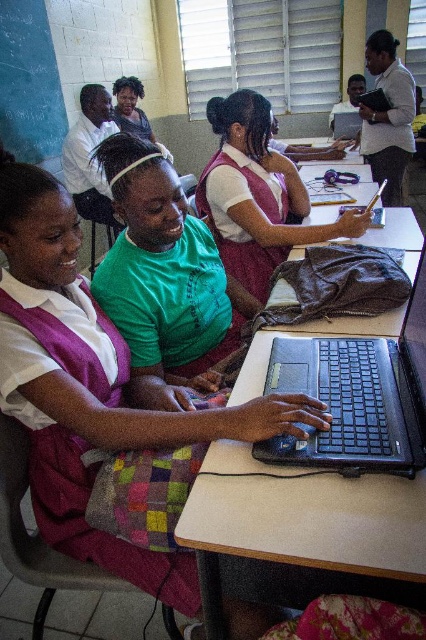
Question: Which object is positioned farthest from the white matte shirt at upper right?

Choices:
 (A) green fabric shirt at center
 (B) black matte laptop at center
 (C) matte pink uniform at center
 (D) matte purple vest at center

Answer: (D)

Question: Which point is farther to the camera?

Choices:
 (A) matte purple vest at center
 (B) white matte shirt at upper right

Answer: (B)

Question: Does matte pink uniform at center appear over white matte shirt at upper right?

Choices:
 (A) yes
 (B) no

Answer: (B)

Question: Does matte purple vest at center appear over white matte shirt at upper right?

Choices:
 (A) no
 (B) yes

Answer: (A)

Question: Observing the image, what is the correct spatial positioning of matte purple vest at center in reference to green fabric shirt at center?

Choices:
 (A) right
 (B) left

Answer: (B)

Question: Which object is farther from the camera taking this photo?

Choices:
 (A) black matte laptop at center
 (B) matte purple vest at center

Answer: (B)